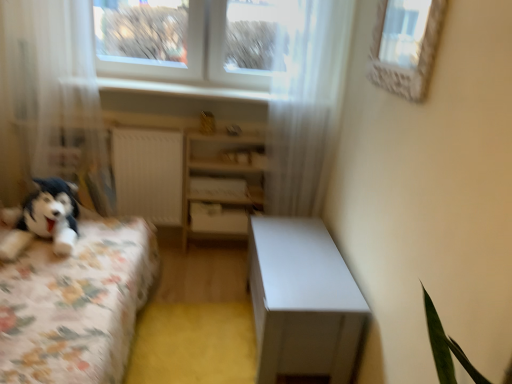
This screenshot has height=384, width=512. In order to click on free point above white matte drawer at center (from a real-world perspective) in this screenshot , I will do `click(220, 205)`.